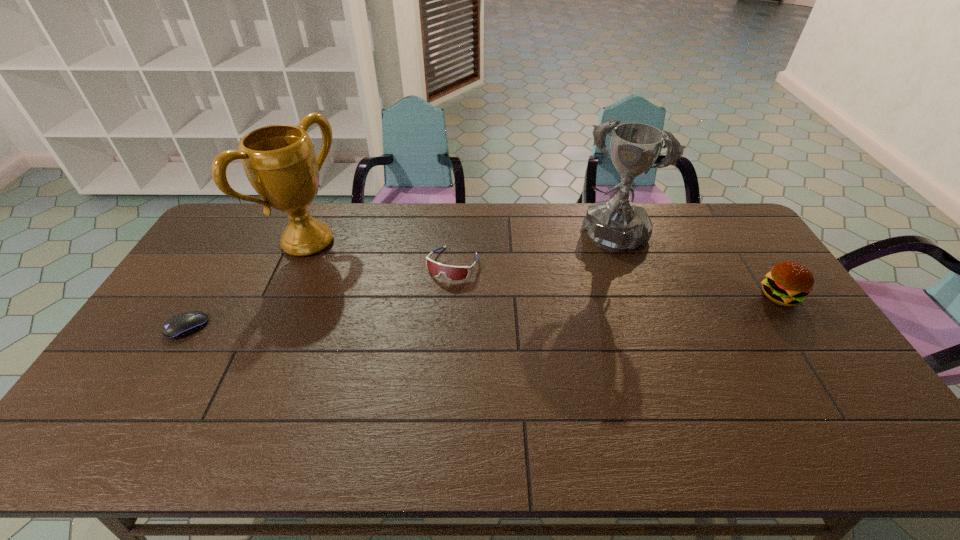
Identify the location of object at the right edge. The image size is (960, 540). 788,283.

The height and width of the screenshot is (540, 960). Find the location of `vacant space at the far edge`. vacant space at the far edge is located at coordinates (263, 236).

Image resolution: width=960 pixels, height=540 pixels. What are the coordinates of `free region at the near edge of the desktop` in the screenshot? It's located at (433, 402).

This screenshot has height=540, width=960. In the image, there is a desktop. What are the coordinates of `vacant space at the left edge` in the screenshot? It's located at (177, 373).

Locate an element on the screen. The image size is (960, 540). vacant point at the right edge is located at coordinates (780, 321).

This screenshot has height=540, width=960. In the image, there is a desktop. What are the coordinates of `free space at the far right corner` in the screenshot? It's located at (742, 242).

Where is `free spot between the fourth tallest object and the second object from left to right`? The image size is (960, 540). free spot between the fourth tallest object and the second object from left to right is located at coordinates (380, 253).

Find the location of a particular element. The width and height of the screenshot is (960, 540). unoccupied area between the goggles and the rightmost object is located at coordinates (616, 280).

Find the location of `free space between the third shortest object and the left award`. free space between the third shortest object and the left award is located at coordinates click(544, 269).

This screenshot has height=540, width=960. I want to click on free space that is in between the left award and the goggles, so click(380, 253).